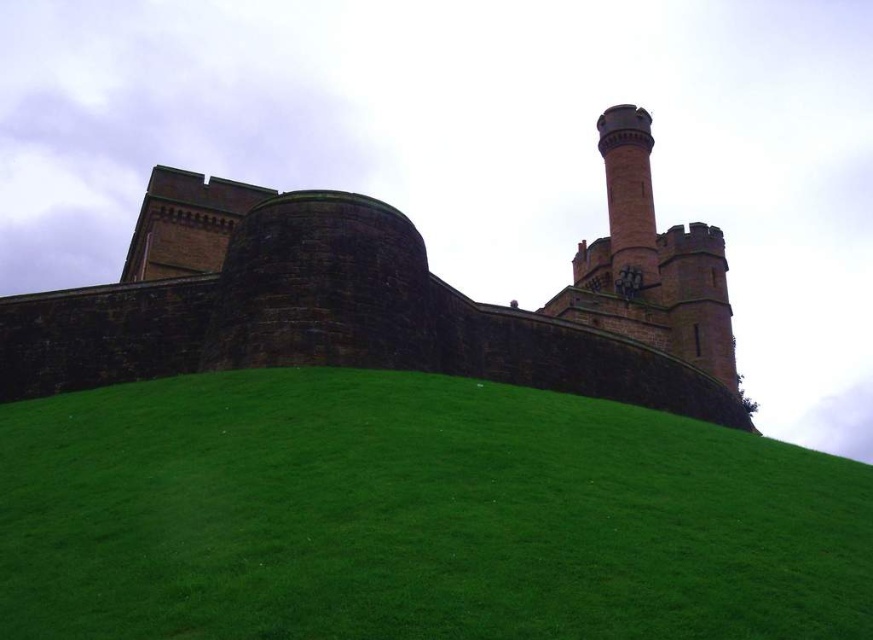
You are a tourist standing at the base of the green grassy hill at lower center, looking up at the brown stone castle at upper center. Which direction should you walk to reach the castle?

Since the green grassy hill at lower center is positioned on the left side of the brown stone castle at upper center, you should walk to the right to reach the castle.

You are a visitor standing at the base of the hill looking up at the historic castle. You notice the brown stone castle at upper center and the red brick chimney at upper right. Which of these two objects is positioned higher up on the hill?

The red brick chimney at upper right is positioned higher up on the hill because the brown stone castle at upper center is located below it.

Based on the photo, you are standing at the base of the castle hill and see two points marked on the slope. The first point is at coordinates point (205, 576) and the second at point (623, 189). Which point is closer to you as you look towards the castle?

Point (205, 576) is closer to you because it is in front of point (623, 189).